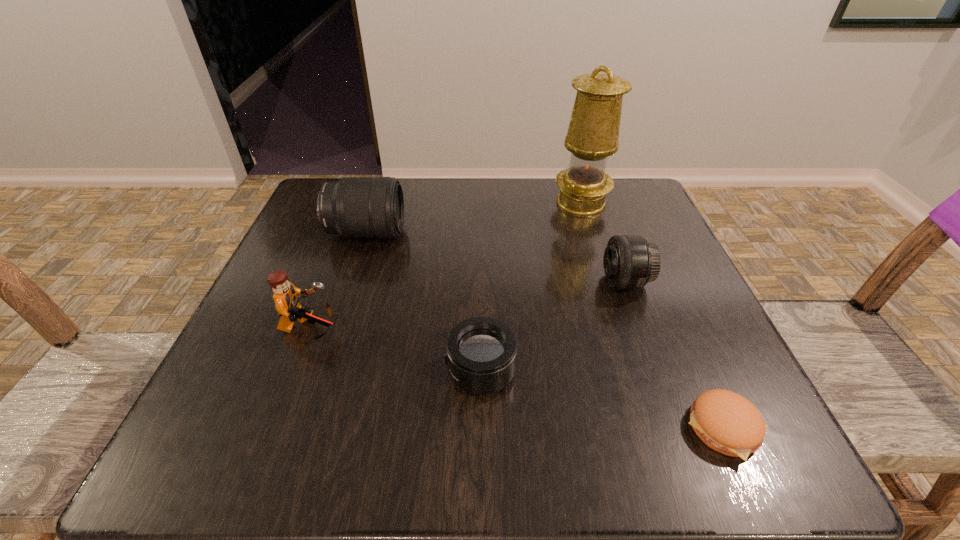
Identify the location of oil lamp. The height and width of the screenshot is (540, 960). (593, 132).

Locate an element on the screen. This screenshot has width=960, height=540. the tallest telephoto lens is located at coordinates (356, 207).

The image size is (960, 540). Identify the location of the leftmost telephoto lens. (356, 207).

In order to click on Lego in this screenshot , I will do `click(286, 296)`.

Where is `the second farthest telephoto lens`? This screenshot has height=540, width=960. the second farthest telephoto lens is located at coordinates (630, 262).

Find the location of a particular element. This screenshot has width=960, height=540. the third farthest object is located at coordinates [630, 262].

The height and width of the screenshot is (540, 960). In order to click on the second shortest object in this screenshot , I will do `click(481, 352)`.

I want to click on the nearest telephoto lens, so pos(481,352).

Identify the location of the shortest object. (725, 421).

This screenshot has height=540, width=960. Find the location of `free space located 0.050m on the front of the oil lamp`. free space located 0.050m on the front of the oil lamp is located at coordinates coord(590,232).